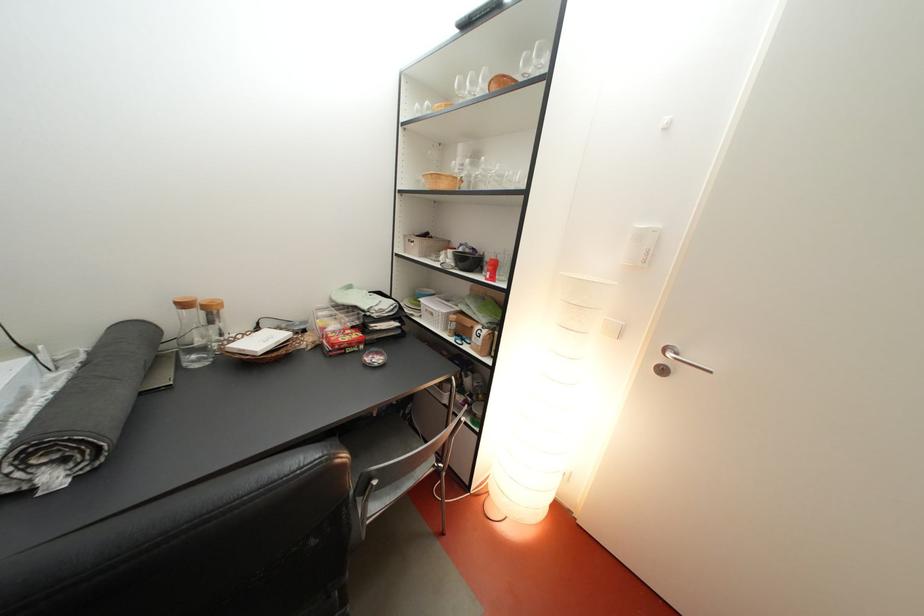
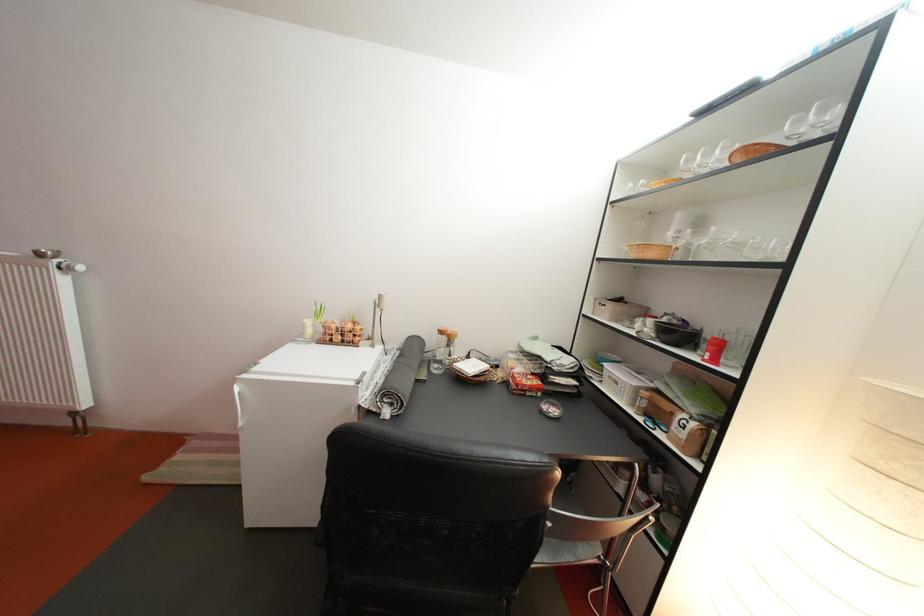
Find the pixel in the second image that matches point 438,241 in the first image.

(630, 306)